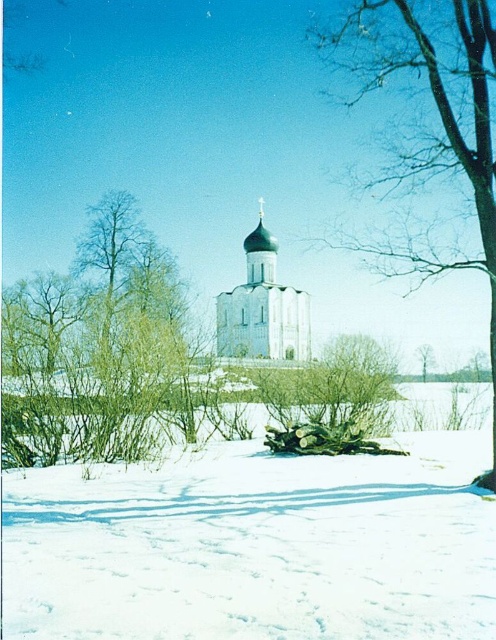
Question: Estimate the real-world distances between objects in this image. Which object is closer to the white powdery snow at lower center?

Choices:
 (A) green leafy tree at center
 (B) white stone church at center
 (C) green metallic spire at center

Answer: (B)

Question: Which point is closer to the camera?

Choices:
 (A) green metallic spire at center
 (B) white powdery snow at lower center
 (C) green leafy tree at center
 (D) white stone church at center

Answer: (B)

Question: Is green leafy shrub at left positioned behind bare wood at center?

Choices:
 (A) no
 (B) yes

Answer: (B)

Question: Is bare wood at center above white stone church at center?

Choices:
 (A) yes
 (B) no

Answer: (A)

Question: Based on their relative distances, which object is nearer to the white stone church at center?

Choices:
 (A) white powdery snow at lower center
 (B) green leafy shrub at left
 (C) bare branches at left

Answer: (B)

Question: Does bare wood at center appear on the right side of green leafy tree at center?

Choices:
 (A) yes
 (B) no

Answer: (B)